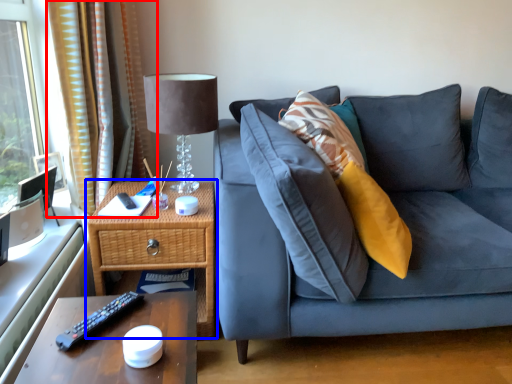
Question: Which of the following is the closest to the observer, curtain (highlighted by a red box) or nightstand (highlighted by a blue box)?

Choices:
 (A) curtain
 (B) nightstand

Answer: (B)